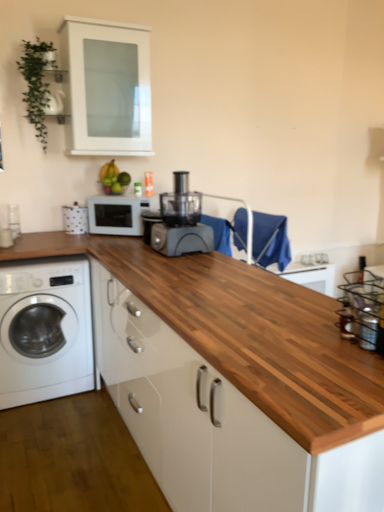
Image resolution: width=384 pixels, height=512 pixels. Find the location of `free space in front of matte black food processor at center`. free space in front of matte black food processor at center is located at coordinates (176, 267).